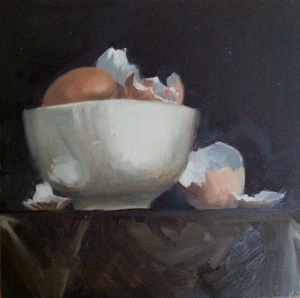
The image size is (300, 298). In order to click on lip of bowl in this screenshot , I will do click(x=75, y=101).